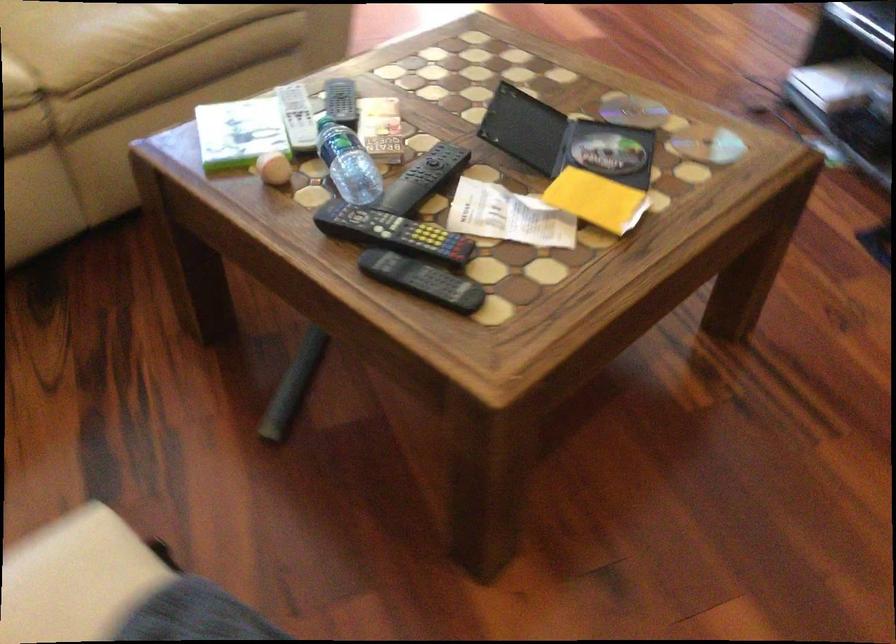
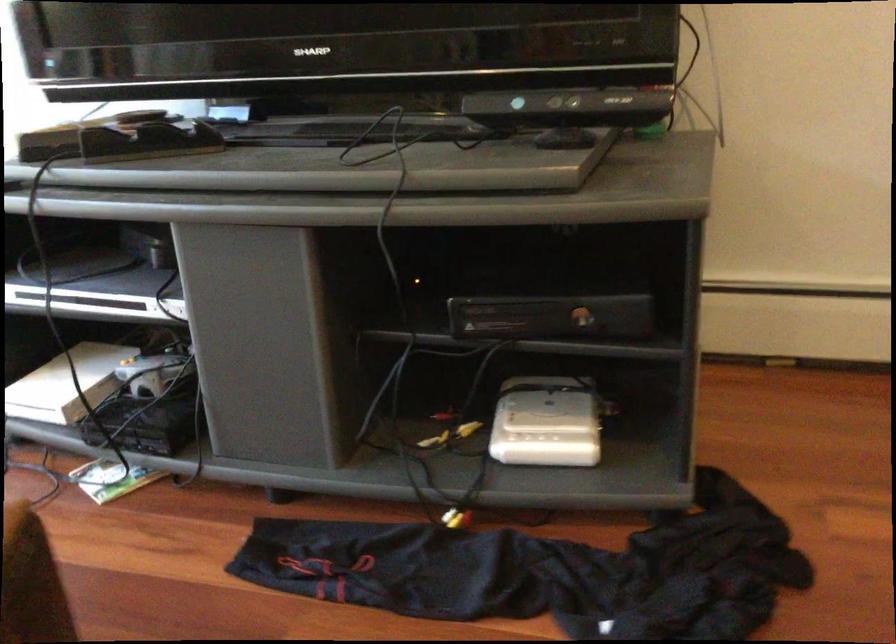
Question: Based on the continuous images, in which direction is the camera rotating? Reply with the corresponding letter.

Choices:
 (A) Left
 (B) Right
 (C) Up
 (D) Down

Answer: (B)